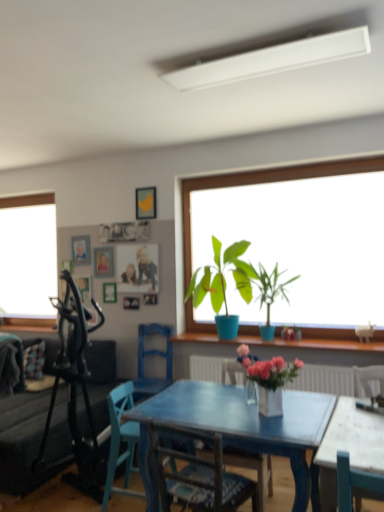
In order to click on vacant area on top of white marble table at lower right (from a real-world perspective) in this screenshot , I will do `click(360, 413)`.